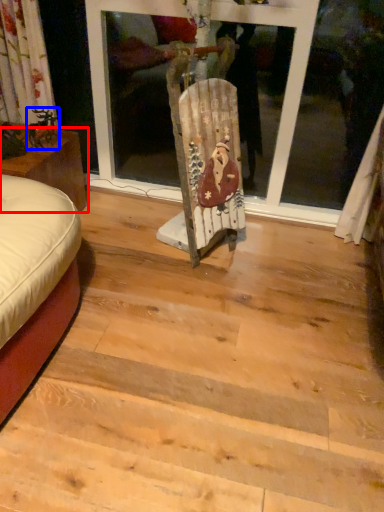
Question: Which of the following is the closest to the observer, furniture (highlighted by a red box) or art (highlighted by a blue box)?

Choices:
 (A) furniture
 (B) art

Answer: (A)